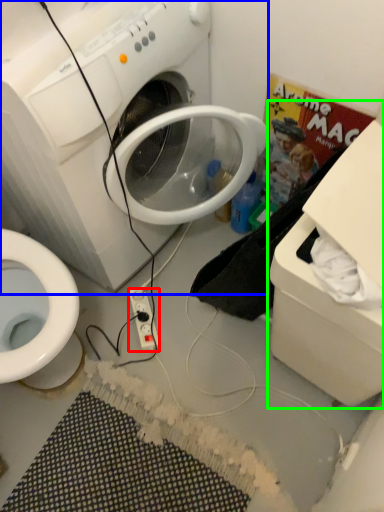
Question: Based on their relative distances, which object is farther from power outlet (highlighted by a red box)? Choose from washing machine (highlighted by a blue box) and cardboard box (highlighted by a green box).

Choices:
 (A) washing machine
 (B) cardboard box

Answer: (B)